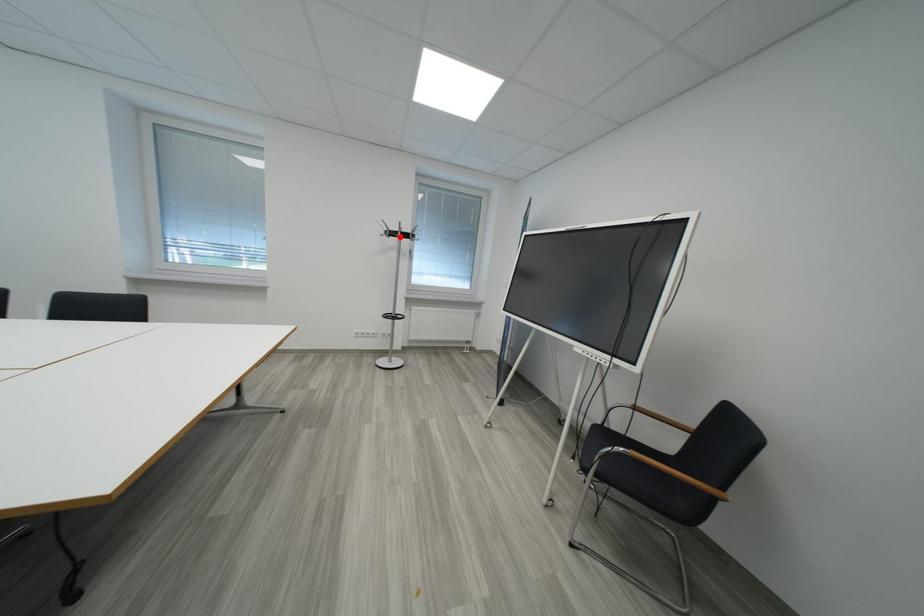
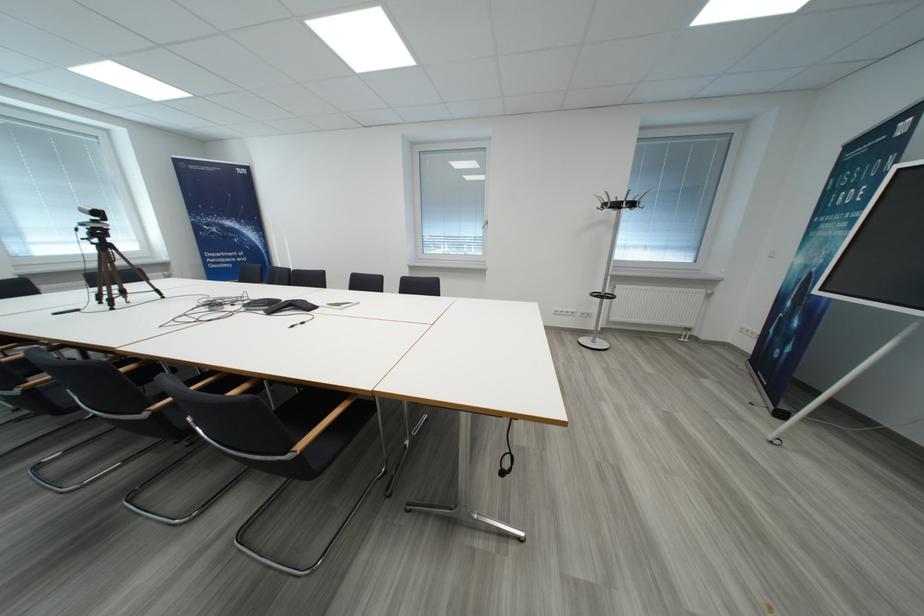
The point at the highlighted location is marked in the first image. Where is the corresponding point in the second image?

(623, 208)